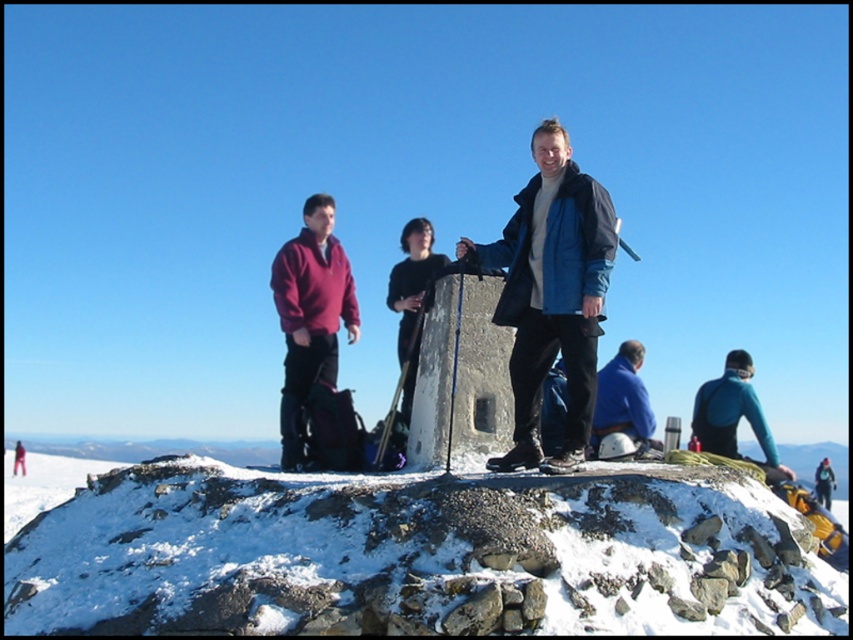
Does point (340, 273) come closer to viewer compared to point (613, 424)?

That is False.

Between point (337, 248) and point (622, 426), which one is positioned behind?

The point (337, 248) is more distant.

Image resolution: width=853 pixels, height=640 pixels. What are the coordinates of `maroon fleece at left` in the screenshot? It's located at (310, 314).

Is point (564, 262) positioned behind point (614, 428)?

No, (564, 262) is closer to viewer.

In the scene shown: Which is below, matte blue jacket at center or blue fabric jacket at center?

matte blue jacket at center

Is point (560, 273) closer to viewer compared to point (630, 413)?

Yes, it is in front of point (630, 413).

Where is `matte blue jacket at center`? matte blue jacket at center is located at coordinates (550, 294).

Which of these two, matte blue jacket at center or maroon fleece at left, stands shorter?

matte blue jacket at center is shorter.

Is matte blue jacket at center thinner than maroon fleece at left?

In fact, matte blue jacket at center might be wider than maroon fleece at left.

Find the location of a particular element. matte blue jacket at center is located at coordinates (550, 294).